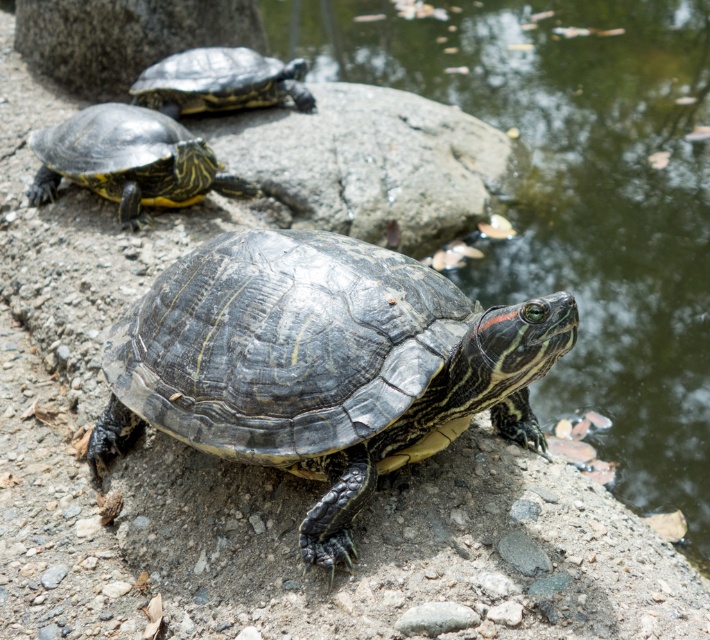
Question: Among these points, which one is farthest from the camera?

Choices:
 (A) (160, 65)
 (B) (633, 35)
 (C) (351, 456)
 (D) (178, 186)

Answer: (B)

Question: Observing the image, what is the correct spatial positioning of glossy water at center in reference to shiny black tortoise at center?

Choices:
 (A) right
 (B) left

Answer: (A)

Question: Which point is farther to the camera?

Choices:
 (A) glossy water at center
 (B) shiny black turtle at upper center
 (C) shiny black turtle at left
 (D) shiny black tortoise at center

Answer: (B)

Question: Which object appears closest to the camera in this image?

Choices:
 (A) shiny black turtle at left
 (B) glossy water at center
 (C) shiny black tortoise at center

Answer: (C)

Question: Can you confirm if glossy water at center is positioned to the right of shiny black turtle at left?

Choices:
 (A) yes
 (B) no

Answer: (A)

Question: From the image, what is the correct spatial relationship of shiny black tortoise at center in relation to shiny black turtle at upper center?

Choices:
 (A) below
 (B) above

Answer: (A)